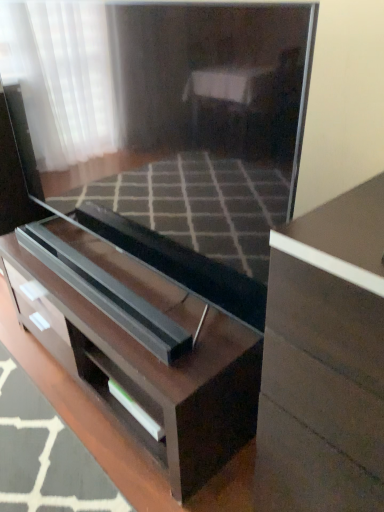
Question: From the image's perspective, is matte brown chest of drawers at right, the first chest of drawers viewed from the right, located above or below dark wood chest of drawers at center, the first chest of drawers from the left?

Choices:
 (A) below
 (B) above

Answer: (A)

Question: Considering their positions, is matte brown chest of drawers at right, the first chest of drawers viewed from the right, located in front of or behind dark wood chest of drawers at center, which is the 2th chest of drawers in right-to-left order?

Choices:
 (A) behind
 (B) front

Answer: (B)

Question: Is matte brown chest of drawers at right, the first chest of drawers viewed from the right, bigger or smaller than dark wood chest of drawers at center, the first chest of drawers from the left?

Choices:
 (A) small
 (B) big

Answer: (A)

Question: In the image, is dark wood chest of drawers at center, which is the 2th chest of drawers in right-to-left order, positioned in front of or behind matte brown chest of drawers at right, which is the 2th chest of drawers in left-to-right order?

Choices:
 (A) front
 (B) behind

Answer: (B)

Question: From the image's perspective, is dark wood chest of drawers at center, which is the 2th chest of drawers in right-to-left order, located above or below matte brown chest of drawers at right, which is the 2th chest of drawers in left-to-right order?

Choices:
 (A) above
 (B) below

Answer: (A)

Question: Is point (251, 430) closer or farther from the camera than point (304, 237)?

Choices:
 (A) farther
 (B) closer

Answer: (A)

Question: From a real-world perspective, is dark wood chest of drawers at center, which is the 2th chest of drawers in right-to-left order, positioned above or below matte brown chest of drawers at right, the first chest of drawers viewed from the right?

Choices:
 (A) below
 (B) above

Answer: (A)